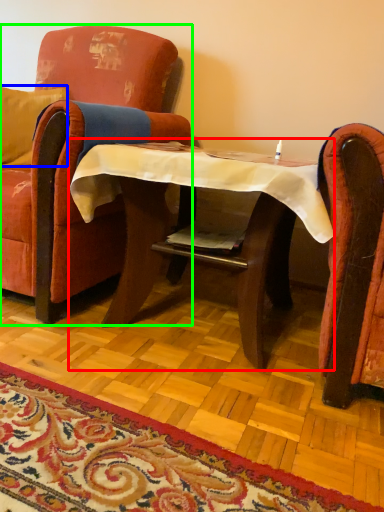
Question: Estimate the real-world distances between objects in this image. Which object is farther from table (highlighted by a red box), pillow (highlighted by a blue box) or chair (highlighted by a green box)?

Choices:
 (A) pillow
 (B) chair

Answer: (A)